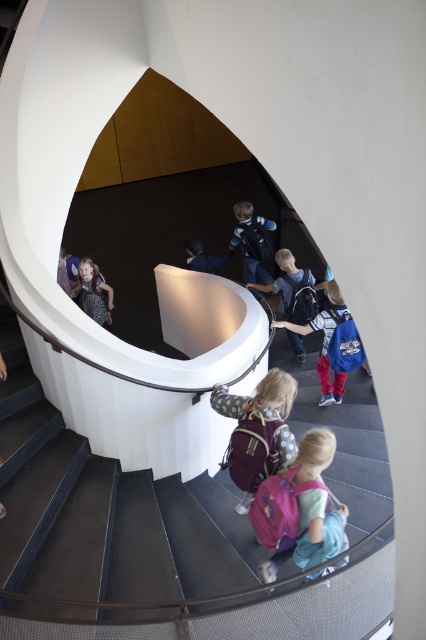
You are a photographer trying to capture both the blue backpack at center and the matte black backpack at lower center in a single shot. Based on their sizes, which backpack will appear larger in the photo?

The blue backpack at center will appear larger in the photo because it is bigger than the matte black backpack at lower center.

You are a photographer trying to capture a photo of the children on the spiral staircase. You need to ensure that both the pink fabric backpack at lower center and the blue fabric jacket at center are clearly visible. Considering their sizes, which object might require you to adjust your camera angle to ensure it doesn not get obscured by other elements?

The pink fabric backpack at lower center occupies less space than the blue fabric jacket at center, so it might require adjusting the camera angle to prevent it from being obscured by other elements due to its smaller size.

You are a photographer trying to capture a photo of the blue backpack at center without the matte black backpack at lower center blocking it. Based on their positions, is this possible?

The blue backpack at center is positioned under the matte black backpack at lower center, so the matte black backpack at lower center would block the view of the blue backpack at center. Therefore, it is not possible to capture the blue backpack at center without the matte black backpack at lower center blocking it.